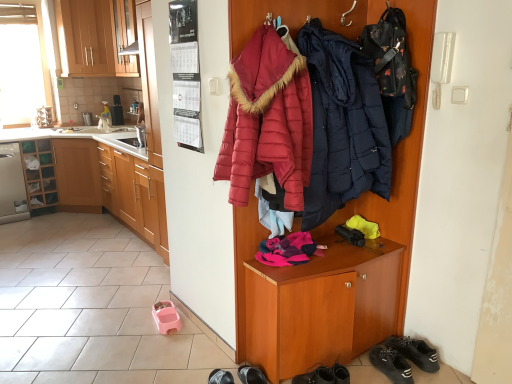
Identify the location of free point below black suede sneakers at lower right, which is the first footwear in right-to-left order (from a real-world perspective). (388, 371).